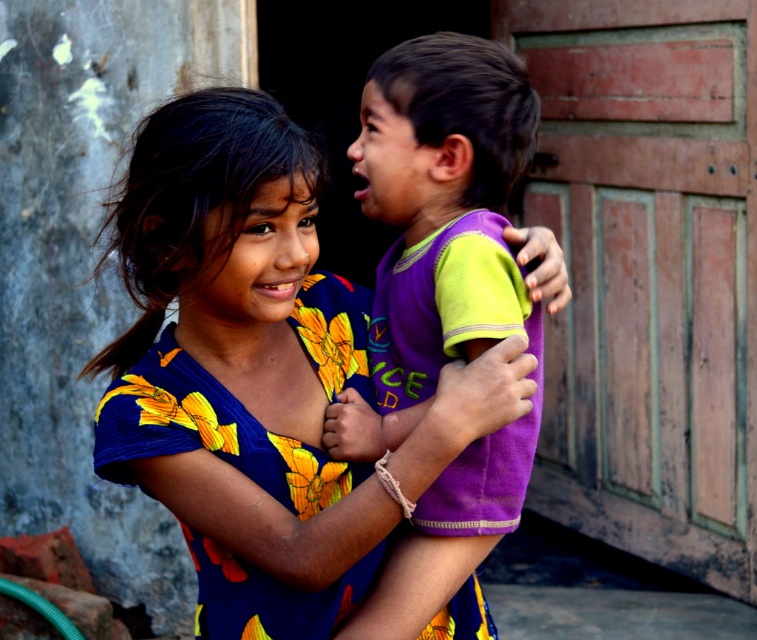
Which of these two, floral fabric dress at center or purple soft fabric shirt at center, stands shorter?

With less height is floral fabric dress at center.

Between floral fabric dress at center and purple soft fabric shirt at center, which one is positioned lower?

Positioned lower is floral fabric dress at center.

Which is in front, point (220, 600) or point (477, 340)?

Point (477, 340) is more forward.

Where is `floral fabric dress at center`? floral fabric dress at center is located at coordinates (240, 365).